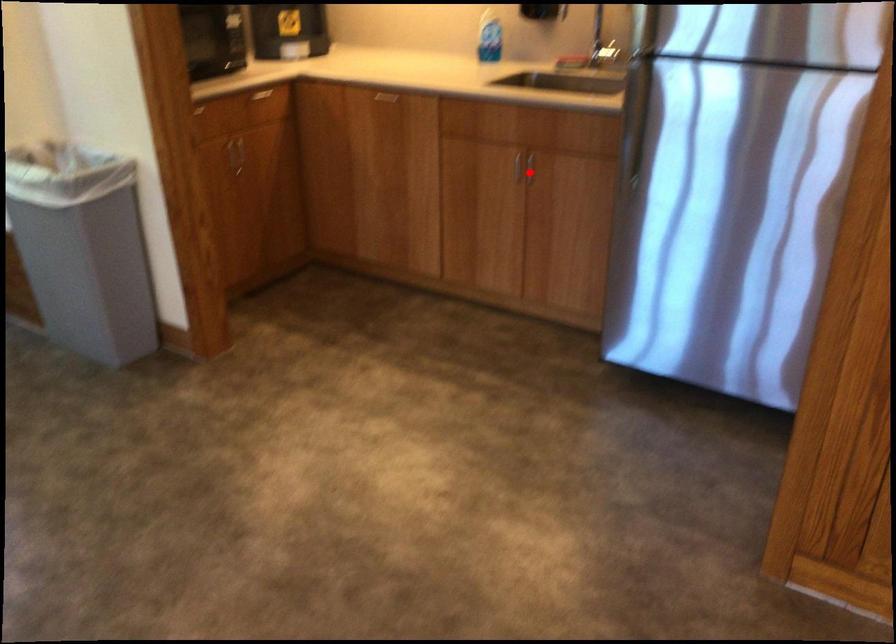
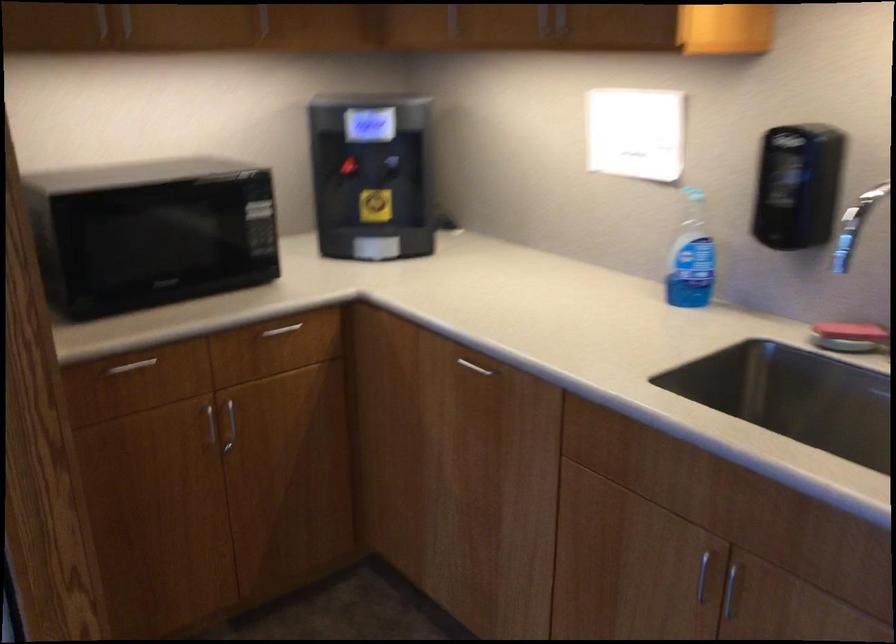
Question: I am providing you with two images of the same scene from different viewpoints. Given a red point in image1, look at the same physical point in image2. Is it:

Choices:
 (A) Closer to the viewpoint
 (B) Farther from the viewpoint

Answer: (A)